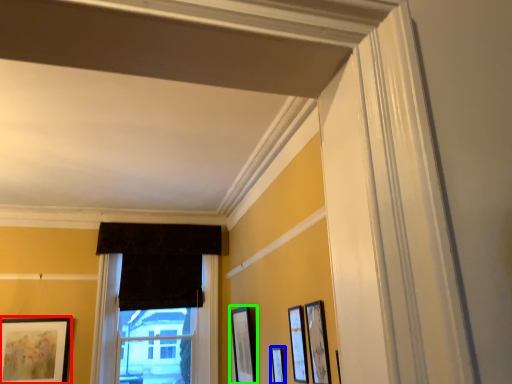
Question: Estimate the real-world distances between objects in this image. Which object is closer to picture frame (highlighted by a red box), picture frame (highlighted by a blue box) or picture frame (highlighted by a green box)?

Choices:
 (A) picture frame
 (B) picture frame

Answer: (B)